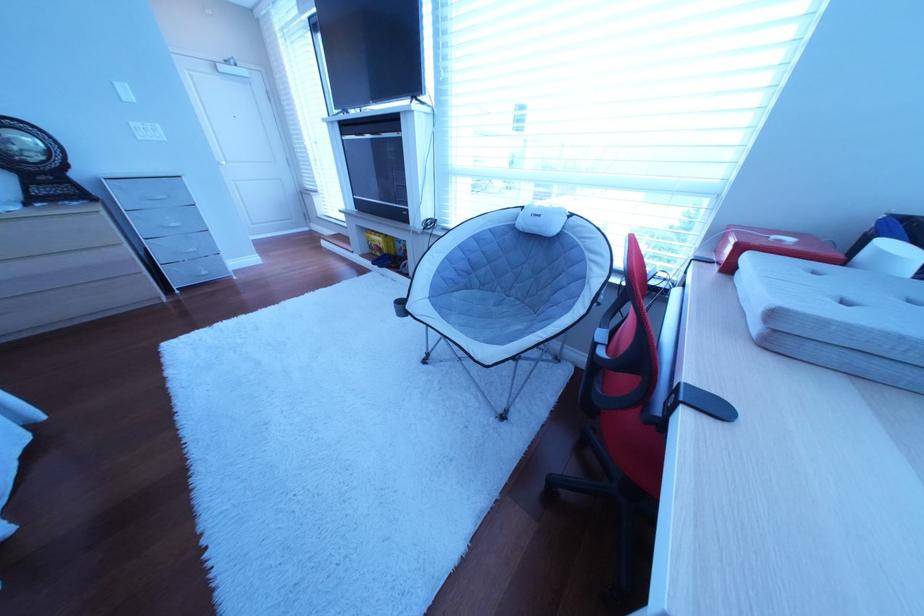
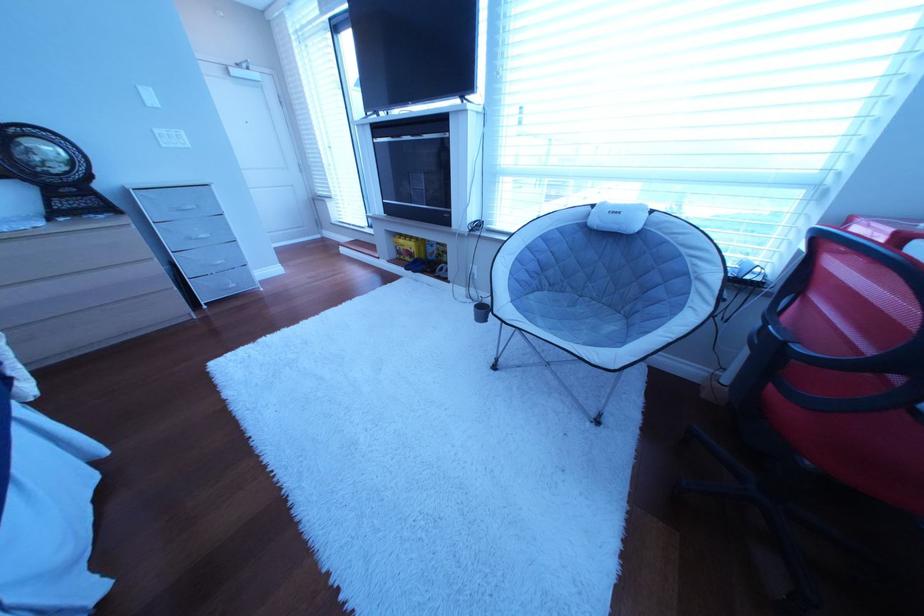
Question: The images are taken continuously from a first-person perspective. In which direction are you moving?

Choices:
 (A) Left
 (B) Right
 (C) Forward
 (D) Backward

Answer: (A)